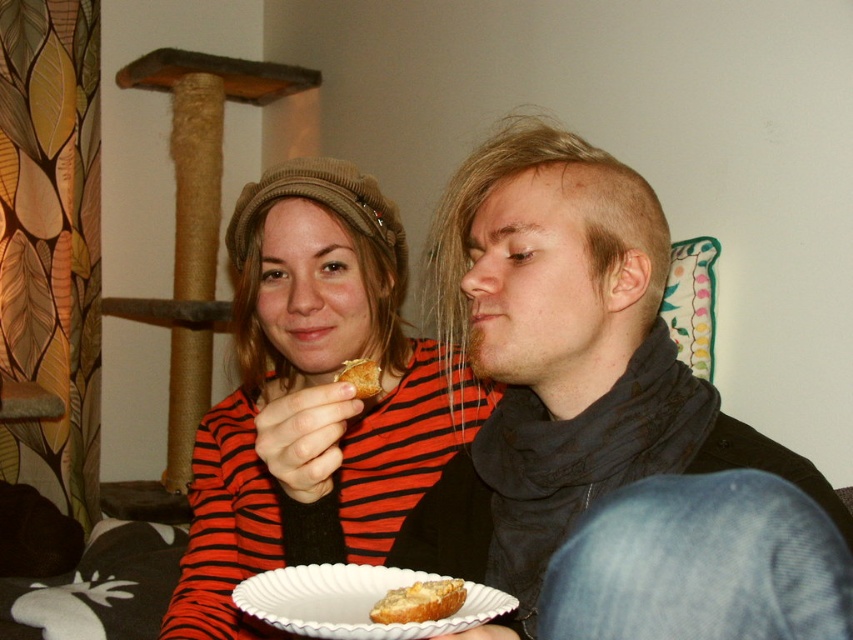
You are standing in front of the scene and want to reach the point marked as point (247, 538). If your arm can extend 30 inches, can you reach that point without moving your feet?

The distance between you and point (247, 538) is 38.70 inches, which is farther than your arm can reach. You cannot reach it without moving your feet.